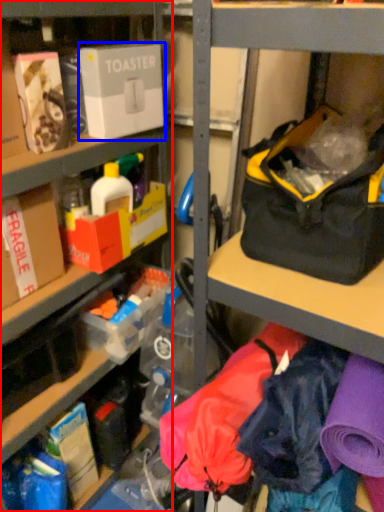
Question: Which of the following is the farthest to the observer, shelf (highlighted by a red box) or box (highlighted by a blue box)?

Choices:
 (A) shelf
 (B) box

Answer: (B)